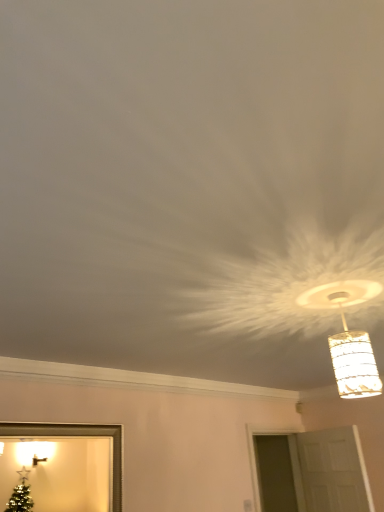
Question: Is gold metallic picture frame at lower left bigger than translucent glass pendant light at upper right?

Choices:
 (A) yes
 (B) no

Answer: (A)

Question: Is gold metallic picture frame at lower left positioned beyond the bounds of translucent glass pendant light at upper right?

Choices:
 (A) yes
 (B) no

Answer: (A)

Question: From the image's perspective, is gold metallic picture frame at lower left located above translucent glass pendant light at upper right?

Choices:
 (A) yes
 (B) no

Answer: (B)

Question: Is gold metallic picture frame at lower left thinner than translucent glass pendant light at upper right?

Choices:
 (A) yes
 (B) no

Answer: (A)

Question: Does gold metallic picture frame at lower left come behind translucent glass pendant light at upper right?

Choices:
 (A) no
 (B) yes

Answer: (B)

Question: Is gold metallic picture frame at lower left to the left of translucent glass pendant light at upper right from the viewer's perspective?

Choices:
 (A) no
 (B) yes

Answer: (B)

Question: Is white matte door at lower right at the left side of gold metallic picture frame at lower left?

Choices:
 (A) no
 (B) yes

Answer: (A)

Question: Is white matte door at lower right behind gold metallic picture frame at lower left?

Choices:
 (A) yes
 (B) no

Answer: (A)

Question: Is white matte door at lower right closer to the viewer compared to gold metallic picture frame at lower left?

Choices:
 (A) yes
 (B) no

Answer: (B)

Question: Is white matte door at lower right with gold metallic picture frame at lower left?

Choices:
 (A) no
 (B) yes

Answer: (A)

Question: From the image's perspective, is white matte door at lower right over gold metallic picture frame at lower left?

Choices:
 (A) yes
 (B) no

Answer: (B)

Question: Considering the relative sizes of white matte door at lower right and gold metallic picture frame at lower left in the image provided, is white matte door at lower right shorter than gold metallic picture frame at lower left?

Choices:
 (A) yes
 (B) no

Answer: (B)

Question: From the image's perspective, does translucent glass pendant light at upper right appear lower than white matte door at lower right?

Choices:
 (A) no
 (B) yes

Answer: (A)